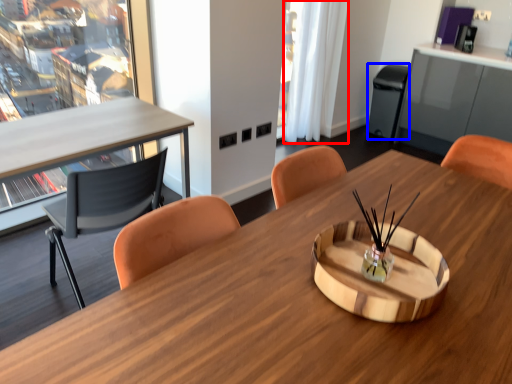
Question: Which point is closer to the camera, curtain (highlighted by a red box) or trash bin/can (highlighted by a blue box)?

Choices:
 (A) curtain
 (B) trash bin/can

Answer: (A)